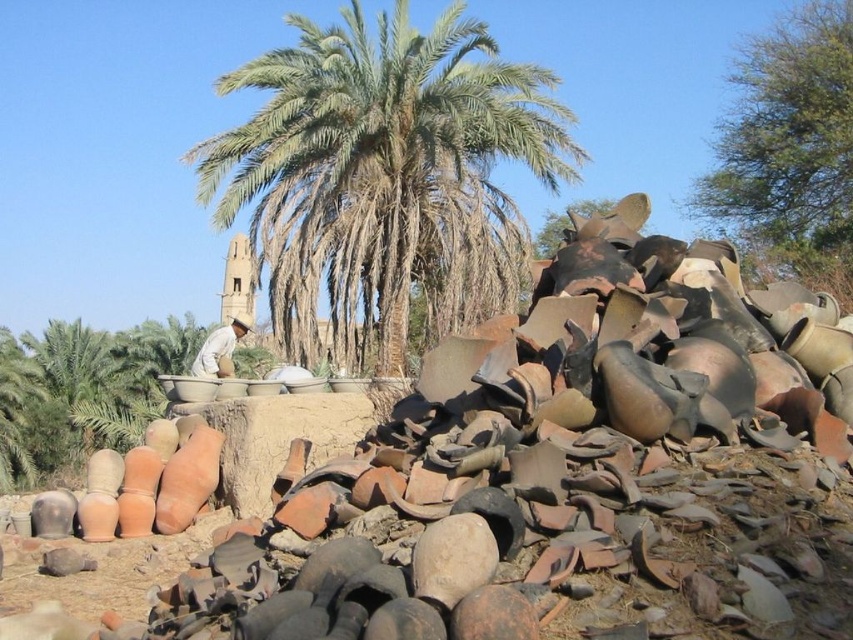
Question: Which point is farther to the camera?

Choices:
 (A) green leafy palm tree at center
 (B) light brown fabric at center

Answer: (A)

Question: Estimate the real-world distances between objects in this image. Which object is farther from the green leafy palm tree at center?

Choices:
 (A) light brown fabric at center
 (B) green leafy tree at upper right

Answer: (B)

Question: Is the position of green leafy palm tree at center less distant than that of green leafy tree at upper right?

Choices:
 (A) yes
 (B) no

Answer: (A)

Question: Among these objects, which one is nearest to the camera?

Choices:
 (A) green leafy tree at upper right
 (B) green leafy palm tree at center
 (C) light brown fabric at center

Answer: (C)

Question: Is green leafy tree at upper right to the left of light brown fabric at center from the viewer's perspective?

Choices:
 (A) no
 (B) yes

Answer: (A)

Question: From the image, what is the correct spatial relationship of green leafy tree at upper right in relation to light brown fabric at center?

Choices:
 (A) right
 (B) left

Answer: (A)